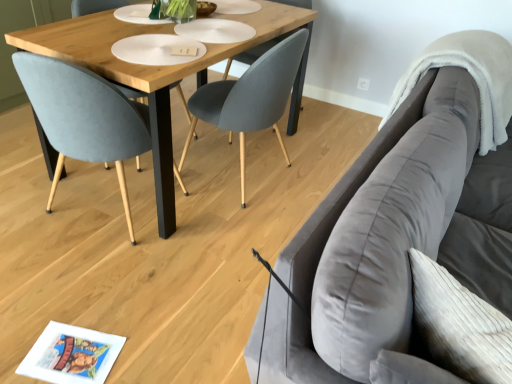
Question: Is the depth of wooden table at center less than that of matte gray chair at center, the 1th chair in the right-to-left sequence?

Choices:
 (A) yes
 (B) no

Answer: (A)

Question: Can we say wooden table at center lies outside matte gray chair at center, which appears as the second chair when viewed from the left?

Choices:
 (A) yes
 (B) no

Answer: (A)

Question: From the image's perspective, would you say wooden table at center is shown under matte gray chair at center, which appears as the second chair when viewed from the left?

Choices:
 (A) no
 (B) yes

Answer: (A)

Question: Is wooden table at center next to matte gray chair at center, which appears as the second chair when viewed from the left, and touching it?

Choices:
 (A) no
 (B) yes

Answer: (A)

Question: Considering the relative sizes of wooden table at center and matte gray chair at center, which appears as the second chair when viewed from the left, in the image provided, is wooden table at center bigger than matte gray chair at center, which appears as the second chair when viewed from the left,?

Choices:
 (A) yes
 (B) no

Answer: (A)

Question: From a real-world perspective, relative to wooden table at center, is velvet gray couch at right vertically above or below?

Choices:
 (A) below
 (B) above

Answer: (B)

Question: From their relative heights in the image, would you say velvet gray couch at right is taller or shorter than wooden table at center?

Choices:
 (A) tall
 (B) short

Answer: (A)

Question: Is velvet gray couch at right spatially inside wooden table at center, or outside of it?

Choices:
 (A) inside
 (B) outside

Answer: (B)

Question: Looking at their shapes, would you say velvet gray couch at right is wider or thinner than wooden table at center?

Choices:
 (A) wide
 (B) thin

Answer: (B)

Question: From the image's perspective, is wooden table at center located above or below white fluffy blanket at upper right?

Choices:
 (A) above
 (B) below

Answer: (A)

Question: Is wooden table at center taller or shorter than white fluffy blanket at upper right?

Choices:
 (A) short
 (B) tall

Answer: (B)

Question: Based on their positions, is wooden table at center located to the left or right of white fluffy blanket at upper right?

Choices:
 (A) left
 (B) right

Answer: (A)

Question: Is wooden table at center bigger or smaller than white fluffy blanket at upper right?

Choices:
 (A) small
 (B) big

Answer: (B)

Question: Is white fluffy blanket at upper right inside or outside of wooden table at center?

Choices:
 (A) inside
 (B) outside

Answer: (B)

Question: Relative to wooden table at center, is white fluffy blanket at upper right in front or behind?

Choices:
 (A) front
 (B) behind

Answer: (B)